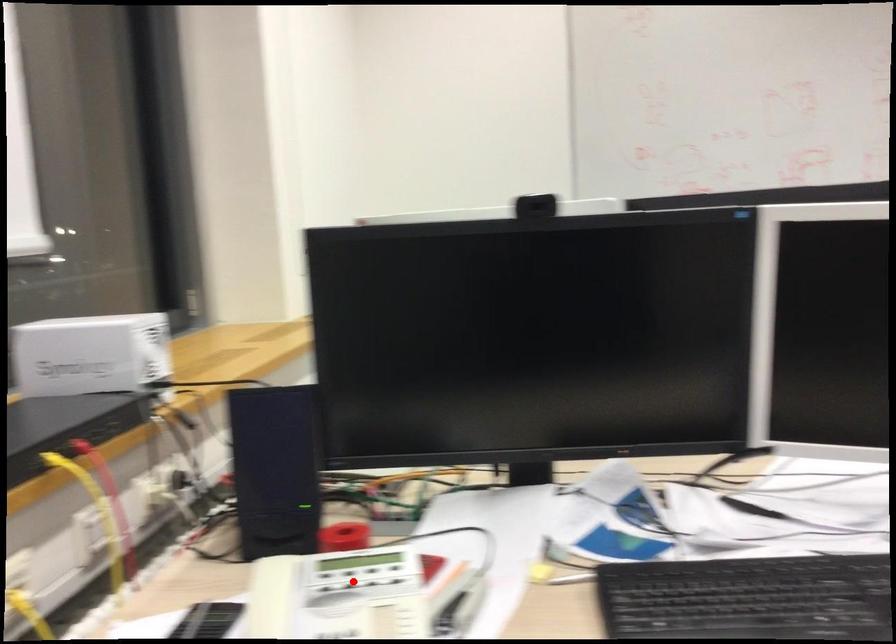
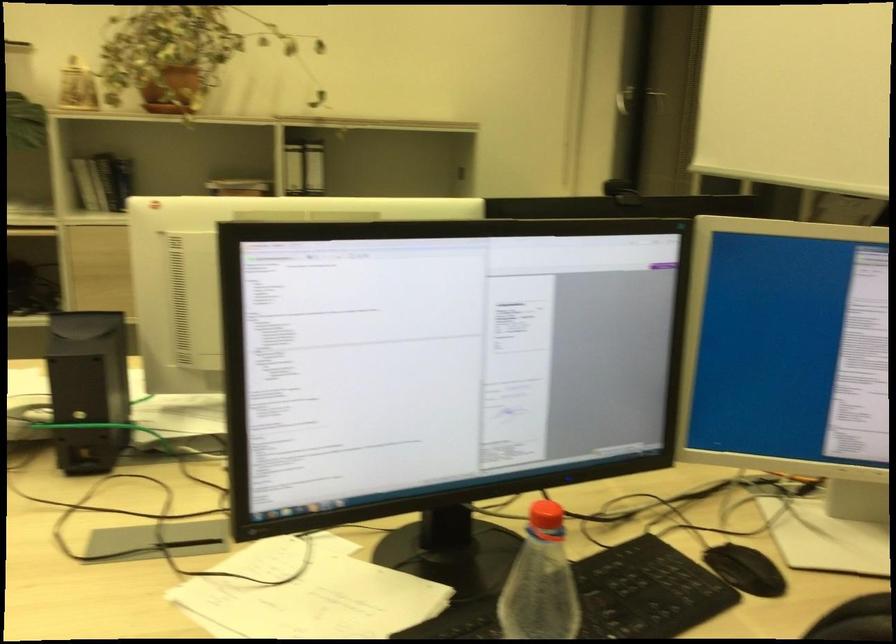
Question: I am providing you with two images of the same scene from different viewpoints. A red point is marked on the first image. Can you still see the location of the red point in image 2?

Choices:
 (A) Yes
 (B) No

Answer: (B)